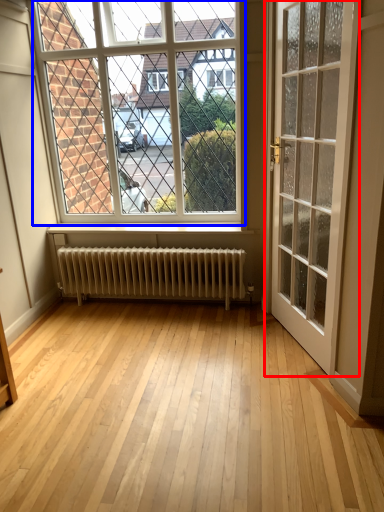
Question: Which of the following is the farthest to the observer, door (highlighted by a red box) or window (highlighted by a blue box)?

Choices:
 (A) door
 (B) window

Answer: (B)